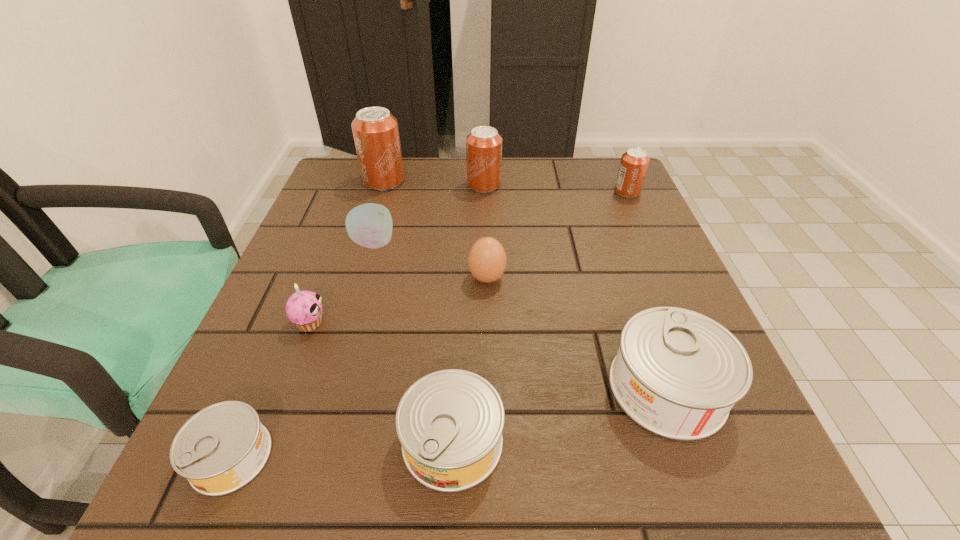
In order to click on the biggest orange can in this screenshot , I will do `click(375, 130)`.

What are the coordinates of `the tallest can` in the screenshot? It's located at (375, 130).

Find the location of a particular element. the second biggest orange can is located at coordinates (483, 145).

Image resolution: width=960 pixels, height=540 pixels. What are the coordinates of `the second orange can from right to left` in the screenshot? It's located at point(483,145).

Where is `the smallest orange can`? the smallest orange can is located at coordinates (634, 162).

Find the location of a particular element. boiled egg is located at coordinates (487, 260).

The height and width of the screenshot is (540, 960). I want to click on the fifth nearest object, so click(487, 260).

I want to click on apple, so click(x=370, y=225).

Where is `the fourth farthest object`? Image resolution: width=960 pixels, height=540 pixels. the fourth farthest object is located at coordinates (370, 225).

You are a GUI agent. You are given a task and a screenshot of the screen. Output one action in this format:
    pyautogui.click(x=<x>, y=<y>)
    Task: Click on the sixth farthest object
    
    Given the screenshot: What is the action you would take?
    pyautogui.click(x=304, y=308)